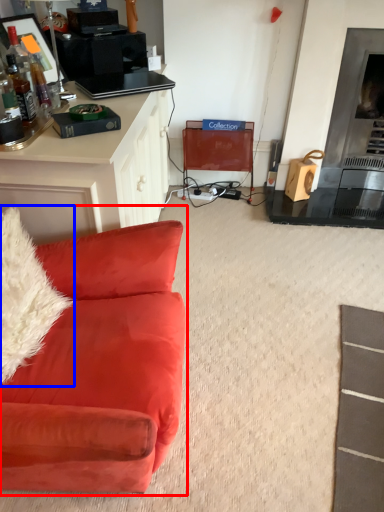
Question: Which point is further to the camera, studio couch (highlighted by a red box) or pillow (highlighted by a blue box)?

Choices:
 (A) studio couch
 (B) pillow

Answer: (B)